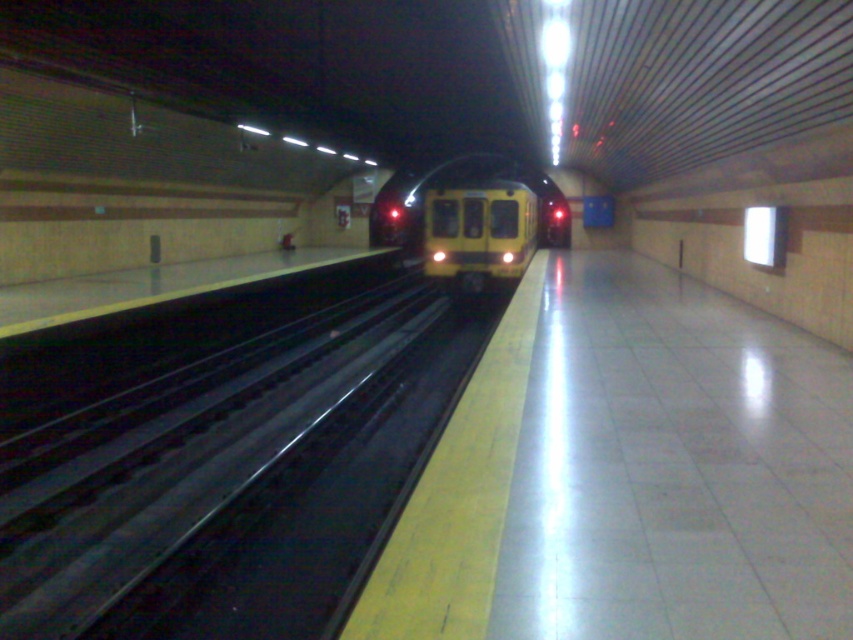
Based on the photo, you are a passenger waiting on the subway platform. You see the black metal track at center and the yellow matte train at center. Which object is closer to your right side?

The yellow matte train at center is closer to your right side because the black metal track at center is positioned on the left side of it.

You are a passenger waiting for the train at the subway station. You notice the black metal track at center and the yellow matte train at center. Which object is taller?

The yellow matte train at center is taller than the black metal track at center.